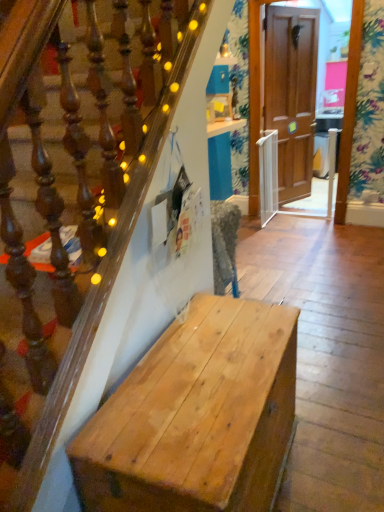
Question: Is natural wood bench at lower left to the left of wooden door at center from the viewer's perspective?

Choices:
 (A) no
 (B) yes

Answer: (B)

Question: Considering the relative sizes of natural wood bench at lower left and wooden door at center in the image provided, is natural wood bench at lower left thinner than wooden door at center?

Choices:
 (A) no
 (B) yes

Answer: (A)

Question: Can you confirm if natural wood bench at lower left is shorter than wooden door at center?

Choices:
 (A) yes
 (B) no

Answer: (A)

Question: Is natural wood bench at lower left wider than wooden door at center?

Choices:
 (A) yes
 (B) no

Answer: (A)

Question: Considering the relative positions of natural wood bench at lower left and wooden door at center in the image provided, is natural wood bench at lower left to the right of wooden door at center from the viewer's perspective?

Choices:
 (A) yes
 (B) no

Answer: (B)

Question: Is natural wood bench at lower left with wooden door at center?

Choices:
 (A) yes
 (B) no

Answer: (B)

Question: Is wooden door at center outside of natural wood bench at lower left?

Choices:
 (A) no
 (B) yes

Answer: (B)

Question: Is wooden door at center to the right of natural wood bench at lower left from the viewer's perspective?

Choices:
 (A) no
 (B) yes

Answer: (B)

Question: Is wooden door at center beside natural wood bench at lower left?

Choices:
 (A) yes
 (B) no

Answer: (B)

Question: From the image's perspective, is wooden door at center located above natural wood bench at lower left?

Choices:
 (A) yes
 (B) no

Answer: (A)

Question: Does wooden door at center appear on the left side of natural wood bench at lower left?

Choices:
 (A) yes
 (B) no

Answer: (B)

Question: Is natural wood bench at lower left located within wooden door at center?

Choices:
 (A) no
 (B) yes

Answer: (A)

Question: Is point (165, 418) closer or farther from the camera than point (299, 76)?

Choices:
 (A) farther
 (B) closer

Answer: (B)